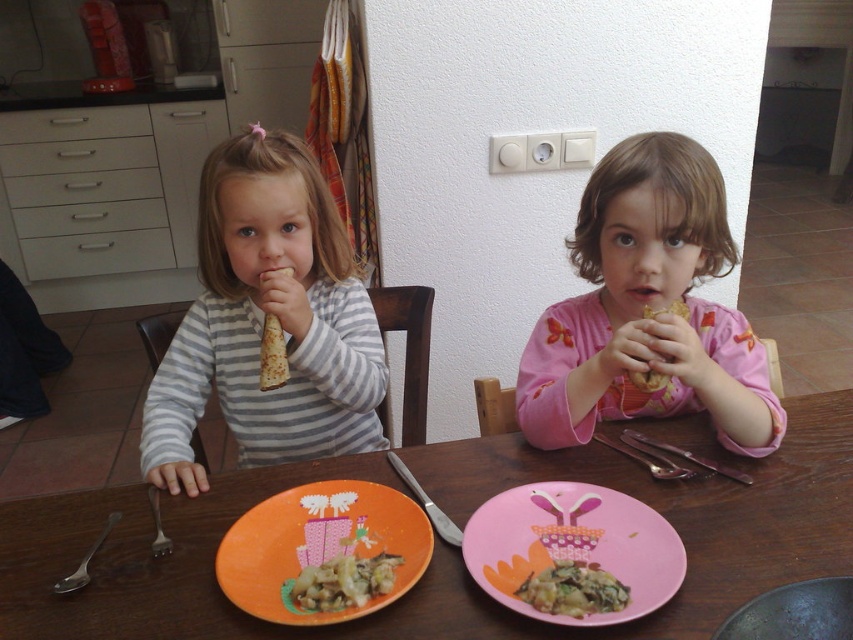
Consider the image. You are standing at the origin point of the image coordinate system. The green leafy vegetables at center are located at point 0.922, 0.673. If you want to move towards them, in which direction should you move first?

Since the green leafy vegetables at center are located at point (573, 589), you should move towards the right and up from your current position at the origin to reach them.